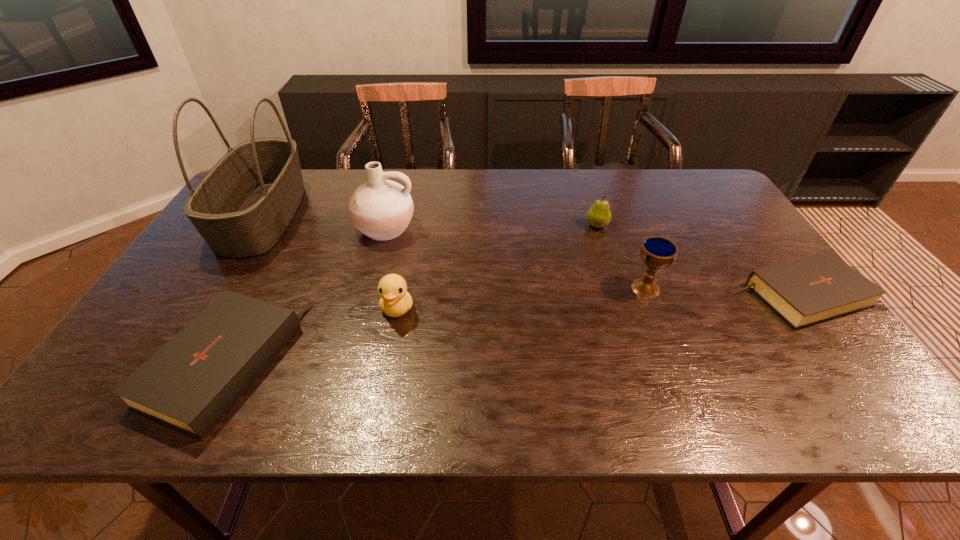
Identify the location of free region located on the left of the right Bible. (595, 295).

Identify the location of free space located 0.220m on the front of the tallest object. (196, 325).

Image resolution: width=960 pixels, height=540 pixels. Identify the location of vacant region located 0.080m on the face of the duck. point(389,352).

Find the location of `free space located on the right of the pear`. free space located on the right of the pear is located at coordinates (674, 226).

Where is `vacant space situated to pour from the handle of the pottery`? Image resolution: width=960 pixels, height=540 pixels. vacant space situated to pour from the handle of the pottery is located at coordinates (366, 300).

The image size is (960, 540). Identify the location of free spot located 0.290m on the right of the chalice. (773, 288).

The image size is (960, 540). Find the location of `object that is at the far edge`. object that is at the far edge is located at coordinates (241, 208).

This screenshot has height=540, width=960. Identify the location of object present at the near edge. (189, 384).

The height and width of the screenshot is (540, 960). In order to click on Bible that is at the left edge in this screenshot , I will do `click(189, 384)`.

Locate an element on the screen. The height and width of the screenshot is (540, 960). basket at the left edge is located at coordinates (241, 208).